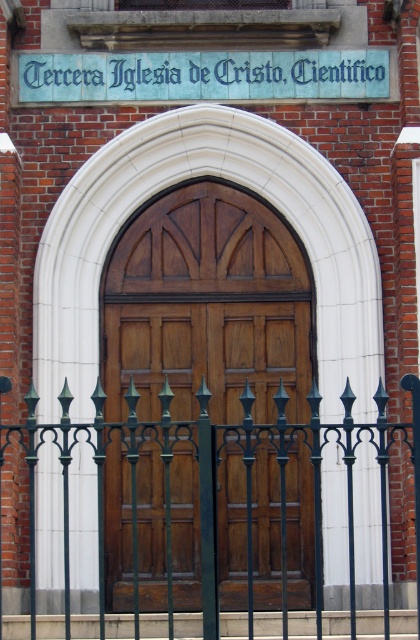
Question: Is green wrought iron fence at center positioned at the back of blue painted signboard at upper center?

Choices:
 (A) no
 (B) yes

Answer: (A)

Question: Is polished wood door at center wider than green wrought iron fence at center?

Choices:
 (A) no
 (B) yes

Answer: (A)

Question: Based on their relative distances, which object is farther from the blue painted signboard at upper center?

Choices:
 (A) green wrought iron fence at center
 (B) polished wood door at center

Answer: (A)

Question: Observing the image, what is the correct spatial positioning of green wrought iron fence at center in reference to blue painted signboard at upper center?

Choices:
 (A) below
 (B) above

Answer: (A)

Question: Considering the real-world distances, which object is closest to the polished wood door at center?

Choices:
 (A) blue painted signboard at upper center
 (B) green wrought iron fence at center

Answer: (A)

Question: Considering the real-world distances, which object is farthest from the polished wood door at center?

Choices:
 (A) blue painted signboard at upper center
 (B) green wrought iron fence at center

Answer: (B)